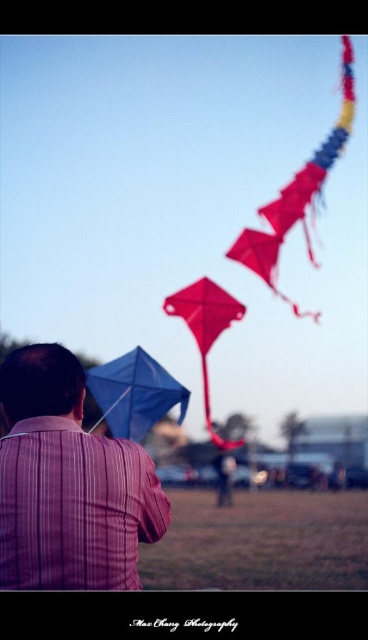
Question: Does matte red kite at upper right appear under shiny red kite at center?

Choices:
 (A) no
 (B) yes

Answer: (A)

Question: In this image, where is matte red kite at upper right located relative to red matte kite at center?

Choices:
 (A) right
 (B) left

Answer: (A)

Question: Which is nearer to the shiny red kite at center?

Choices:
 (A) brown grass at lower center
 (B) blue fabric kite at center

Answer: (A)

Question: Which of the following is the farthest from the observer?

Choices:
 (A) red matte kite at center
 (B) matte red kite at upper right

Answer: (B)

Question: Is shiny red kite at center to the left of red matte kite at center from the viewer's perspective?

Choices:
 (A) no
 (B) yes

Answer: (B)

Question: Which object appears closest to the camera in this image?

Choices:
 (A) plaid shirt at center
 (B) blue fabric kite at center
 (C) matte red kite at upper right

Answer: (A)